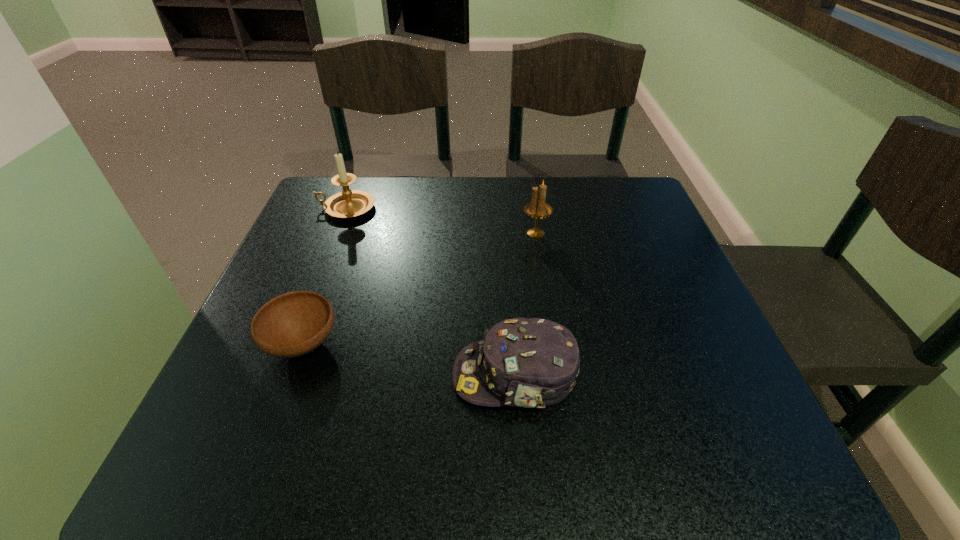
You are a GUI agent. You are given a task and a screenshot of the screen. Output one action in this format:
    pyautogui.click(x=<x>, y=<y>)
    Task: Click on the vacant space at the near right corner of the desktop
    
    Given the screenshot: What is the action you would take?
    pyautogui.click(x=732, y=468)

The height and width of the screenshot is (540, 960). Identify the location of free area in between the shortest object and the nearer candle holder. (420, 289).

Where is `free space between the farther candle holder and the shortest object`? Image resolution: width=960 pixels, height=540 pixels. free space between the farther candle holder and the shortest object is located at coordinates (324, 276).

The height and width of the screenshot is (540, 960). Identify the location of vacant area that lies between the third tallest object and the shortest object. (409, 360).

I want to click on vacant area between the third tallest object and the shortest object, so click(409, 360).

The height and width of the screenshot is (540, 960). Find the location of `vacant space in between the right candle holder and the third tallest object`. vacant space in between the right candle holder and the third tallest object is located at coordinates (525, 305).

Locate an element on the screen. This screenshot has height=540, width=960. vacant area between the headwear and the left candle holder is located at coordinates (431, 292).

I want to click on unoccupied position between the headwear and the farther candle holder, so click(x=431, y=292).

Find the location of `free space that is in between the headwear and the right candle holder`. free space that is in between the headwear and the right candle holder is located at coordinates (525, 305).

You are a GUI agent. You are given a task and a screenshot of the screen. Output one action in this format:
    pyautogui.click(x=<x>, y=<y>)
    Task: Click on the free space between the headwear and the left candle holder
    
    Given the screenshot: What is the action you would take?
    pyautogui.click(x=431, y=292)